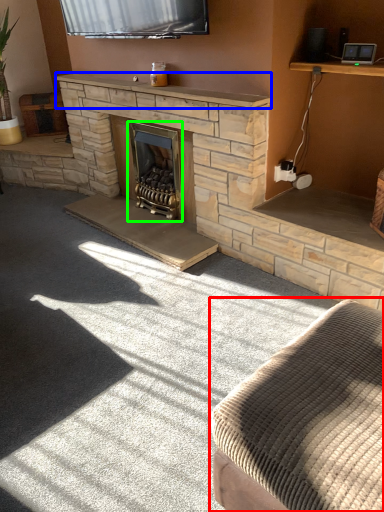
Question: Which is nearer to the studio couch (highlighted by a red box)? mantle (highlighted by a blue box) or wood burning stove (highlighted by a green box).

Choices:
 (A) mantle
 (B) wood burning stove

Answer: (A)